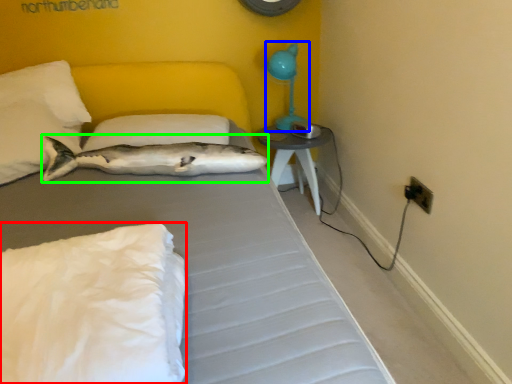
Question: Which object is positioned closest to pillow (highlighted by a red box)? Select from table lamp (highlighted by a blue box) and fish (highlighted by a green box).

Choices:
 (A) table lamp
 (B) fish

Answer: (B)